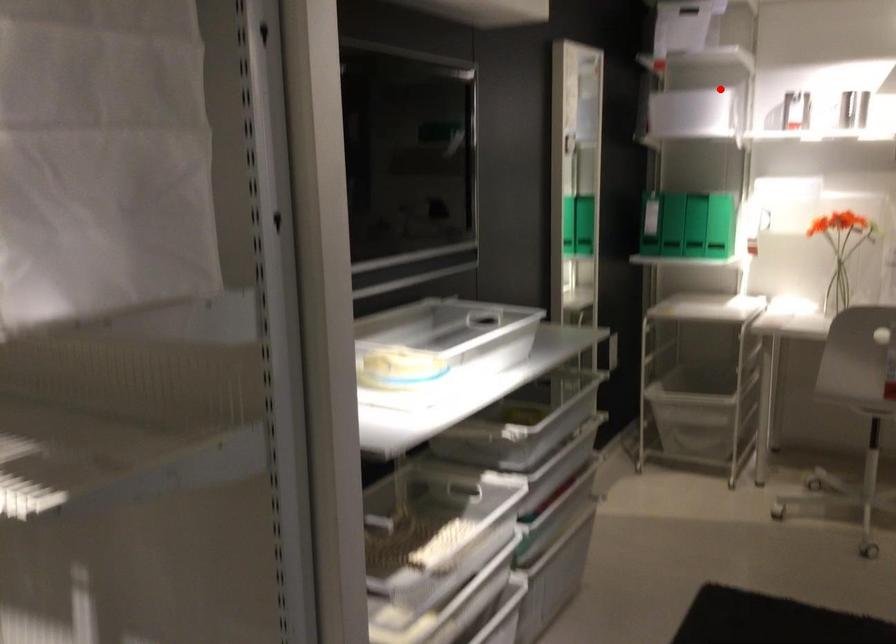
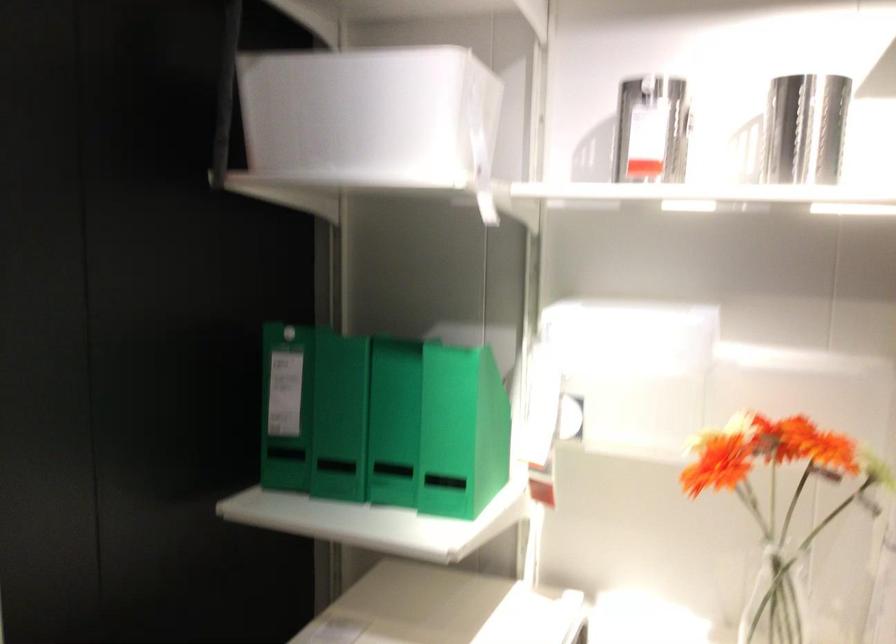
Question: I am providing you with two images of the same scene from different viewpoints. Image1 has a red point marked. In image2, the corresponding 3D location appears at what relative position? Reply with the corresponding letter.

Choices:
 (A) Closer
 (B) Farther

Answer: (A)